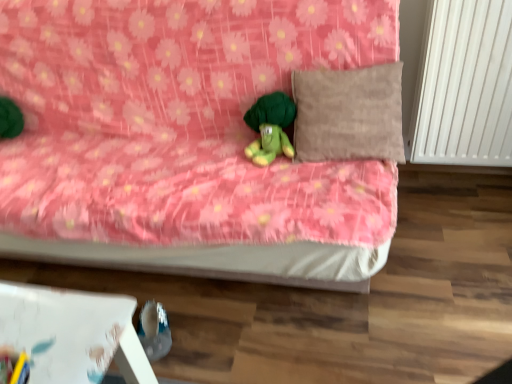
Question: Does pink floral fabric bed at center lie in front of white smooth radiator at right?

Choices:
 (A) no
 (B) yes

Answer: (B)

Question: From a real-world perspective, is pink floral fabric bed at center on top of white smooth radiator at right?

Choices:
 (A) yes
 (B) no

Answer: (B)

Question: Does pink floral fabric bed at center appear on the right side of white smooth radiator at right?

Choices:
 (A) yes
 (B) no

Answer: (B)

Question: Does pink floral fabric bed at center have a smaller size compared to white smooth radiator at right?

Choices:
 (A) no
 (B) yes

Answer: (A)

Question: Is pink floral fabric bed at center located outside white smooth radiator at right?

Choices:
 (A) no
 (B) yes

Answer: (B)

Question: Considering the relative sizes of pink floral fabric bed at center and white smooth radiator at right in the image provided, is pink floral fabric bed at center thinner than white smooth radiator at right?

Choices:
 (A) no
 (B) yes

Answer: (A)

Question: Is green plush turtle at center at the right side of white smooth radiator at right?

Choices:
 (A) no
 (B) yes

Answer: (A)

Question: Considering the relative sizes of green plush turtle at center and white smooth radiator at right in the image provided, is green plush turtle at center smaller than white smooth radiator at right?

Choices:
 (A) yes
 (B) no

Answer: (A)

Question: Considering the relative positions of green plush turtle at center and white smooth radiator at right in the image provided, is green plush turtle at center to the left of white smooth radiator at right from the viewer's perspective?

Choices:
 (A) yes
 (B) no

Answer: (A)

Question: Does green plush turtle at center come behind white smooth radiator at right?

Choices:
 (A) no
 (B) yes

Answer: (B)

Question: Can you confirm if green plush turtle at center is bigger than white smooth radiator at right?

Choices:
 (A) yes
 (B) no

Answer: (B)

Question: Considering the relative positions of green plush turtle at center and white smooth radiator at right in the image provided, is green plush turtle at center in front of white smooth radiator at right?

Choices:
 (A) no
 (B) yes

Answer: (A)

Question: Does white smooth radiator at right come behind green plush turtle at center?

Choices:
 (A) yes
 (B) no

Answer: (B)